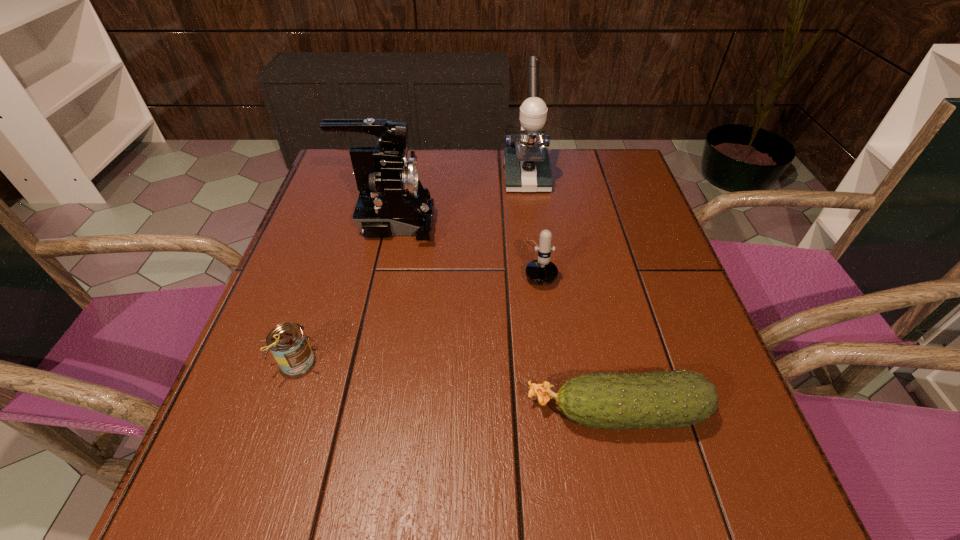
This screenshot has width=960, height=540. In order to click on the farthest object in this screenshot , I will do `click(527, 167)`.

Find the location of a particular element. camcorder is located at coordinates (392, 201).

At what (x,y) coordinates should I click in order to perform the action: click on microphone. Please return your answer as a coordinate pair (x, y). The height and width of the screenshot is (540, 960). Looking at the image, I should click on (542, 271).

What are the coordinates of `can` in the screenshot? It's located at (288, 343).

Find the location of a particular element. The width and height of the screenshot is (960, 540). the shortest object is located at coordinates (678, 398).

The image size is (960, 540). I want to click on the nearest object, so click(678, 398).

Where is `free space located 0.060m on the back of the farthest object`? The image size is (960, 540). free space located 0.060m on the back of the farthest object is located at coordinates pos(522,151).

The image size is (960, 540). Find the location of `free space located 0.300m on the lens mount of the camcorder`. free space located 0.300m on the lens mount of the camcorder is located at coordinates pyautogui.click(x=559, y=222).

Locate an element on the screen. vacant space situated on the front of the microphone is located at coordinates (547, 329).

Locate an element on the screen. vacant region located 0.160m on the back of the can is located at coordinates (324, 280).